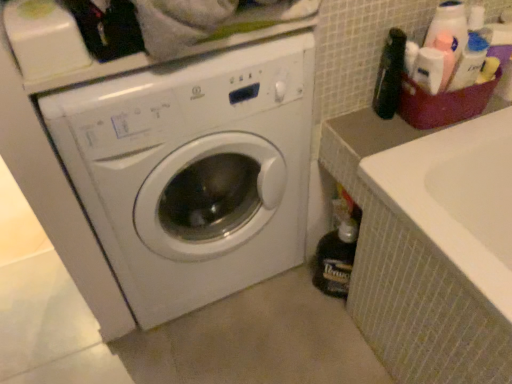
Where is `vacant area that lies in front of white glossy washing machine at center`? The width and height of the screenshot is (512, 384). vacant area that lies in front of white glossy washing machine at center is located at coordinates (225, 348).